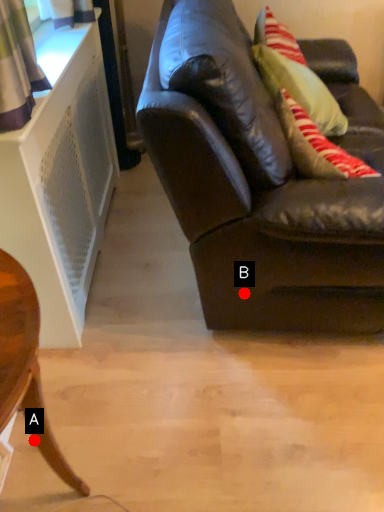
Question: Two points are circled on the image, labeled by A and B beside each circle. Which point is farther from the camera taking this photo?

Choices:
 (A) A is further
 (B) B is further

Answer: (B)